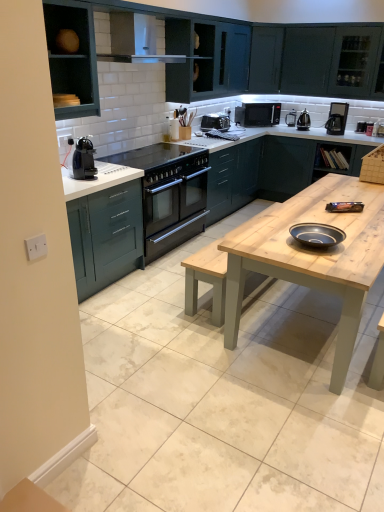
Identify the location of empty space that is to the right of matte blue bowl at center. The width and height of the screenshot is (384, 512). (362, 237).